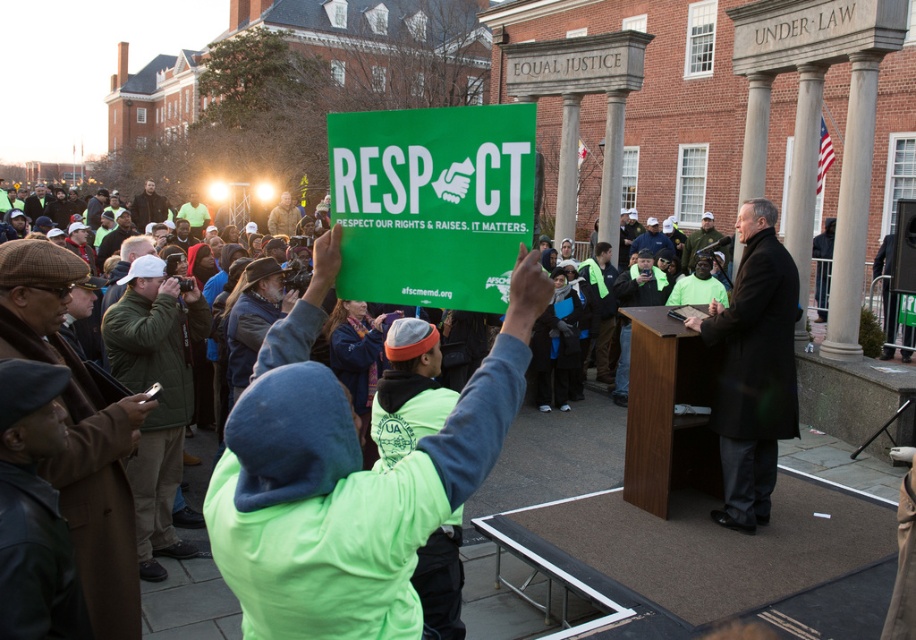
A person is standing at the center of the scene wearing a neon green jacket. They are holding a large green sign that says RESPECT. How far apart are the neon green jacket at center and the sign?

The neon green jacket at center and the sign are 1.74 meters apart.

You are a photographer trying to capture a clear photo of the neon green jacket at center and the black coat at center. If you want to ensure both are fully visible in the frame without cropping either, what should you consider about their sizes?

The neon green jacket at center might be wider than the black coat at center, so you should position the camera to accommodate the wider width of the neon green jacket at center to ensure both are fully visible.